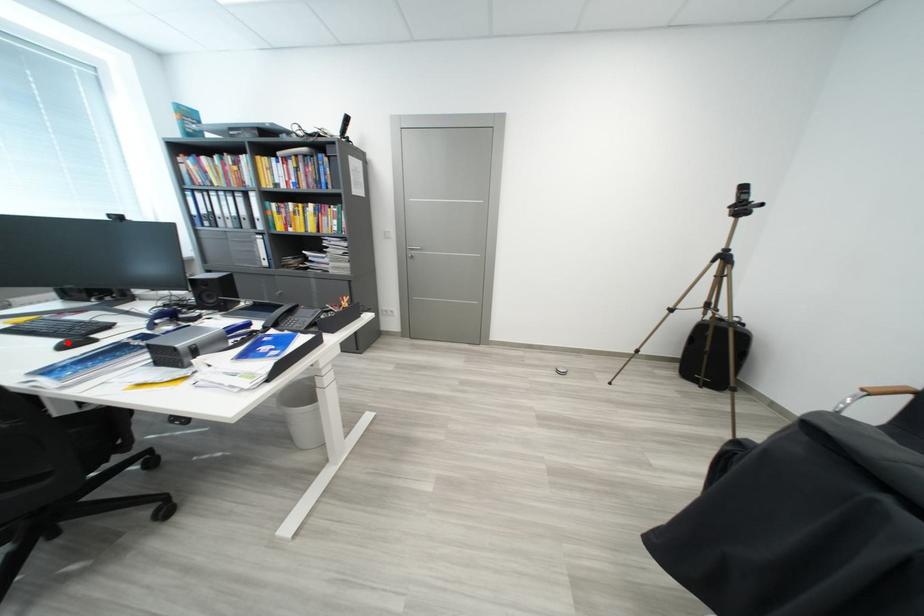
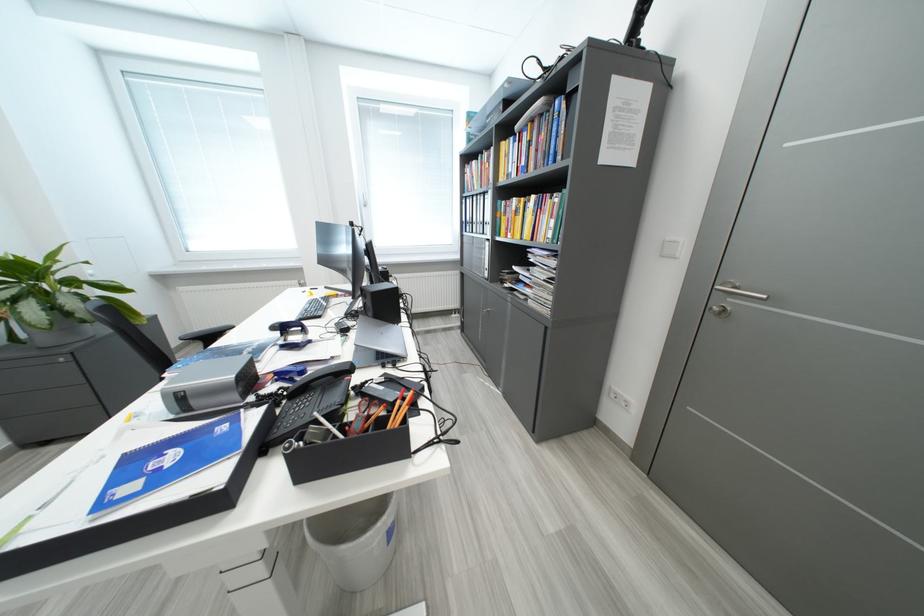
In the second image, find the point that corresponds to the highlighted location in the first image.

(286, 323)